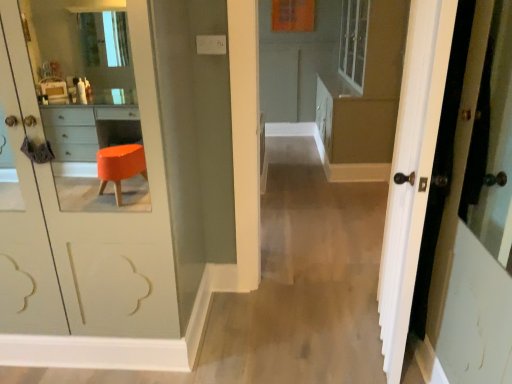
Image resolution: width=512 pixels, height=384 pixels. What are the coordinates of `white wood door at right` in the screenshot? It's located at (462, 201).

What do you see at coordinates (462, 201) in the screenshot? I see `white wood door at right` at bounding box center [462, 201].

Measure the distance between point (398, 222) and camera.

Point (398, 222) is 5.68 feet from camera.

Find the location of a particular element. The width and height of the screenshot is (512, 384). matte brown dresser at center is located at coordinates (353, 131).

Measure the distance between point (376, 173) and camera.

Point (376, 173) and camera are 4.23 meters apart.

The width and height of the screenshot is (512, 384). Describe the element at coordinates (353, 131) in the screenshot. I see `matte brown dresser at center` at that location.

Image resolution: width=512 pixels, height=384 pixels. I want to click on white wood door at right, so click(462, 201).

Is matte brown dresser at center to the right of white wood door at right from the viewer's perspective?

Yes.

Is the position of matte brown dresser at center more distant than that of white wood door at right?

Yes, matte brown dresser at center is behind white wood door at right.

Is point (372, 107) less distant than point (500, 210)?

No.

From the image's perspective, is matte brown dresser at center beneath white wood door at right?

No.

From a real-world perspective, which object stands above the other?

In real-world perspective, matte brown dresser at center is above.

Which object is wider, matte brown dresser at center or white wood door at right?

matte brown dresser at center is wider.

Between matte brown dresser at center and white wood door at right, which one has more height?

Standing taller between the two is matte brown dresser at center.

Based on their sizes in the image, would you say matte brown dresser at center is bigger or smaller than white wood door at right?

Considering their sizes, matte brown dresser at center takes up more space than white wood door at right.

Is matte brown dresser at center located outside white wood door at right?

Yes, matte brown dresser at center is located beyond the bounds of white wood door at right.

Would you consider matte brown dresser at center to be distant from white wood door at right?

Yes, matte brown dresser at center and white wood door at right are located far from each other.

Could you tell me if matte brown dresser at center is turned towards white wood door at right?

No, matte brown dresser at center is not turned towards white wood door at right.

How many degrees apart are the facing directions of matte brown dresser at center and white wood door at right?

The facing directions of matte brown dresser at center and white wood door at right are 9.44 degrees apart.

Identify the location of door directly beneath the matte brown dresser at center (from a real-world perspective). (462, 201).

Which is more to the right, white wood door at right or matte brown dresser at center?

matte brown dresser at center is more to the right.

Is white wood door at right positioned in front of matte brown dresser at center?

Yes, white wood door at right is in front of matte brown dresser at center.

Which point is more distant from viewer, (471, 83) or (328, 85)?

The point (328, 85) is more distant.

From the image's perspective, is white wood door at right located above matte brown dresser at center?

Actually, white wood door at right appears below matte brown dresser at center in the image.

From a real-world perspective, which object rests below the other?

From a 3D spatial view, white wood door at right is below.

Can you confirm if white wood door at right is thinner than matte brown dresser at center?

Correct, the width of white wood door at right is less than that of matte brown dresser at center.

Considering the relative sizes of white wood door at right and matte brown dresser at center in the image provided, is white wood door at right shorter than matte brown dresser at center?

Yes.

Considering the relative sizes of white wood door at right and matte brown dresser at center in the image provided, is white wood door at right bigger than matte brown dresser at center?

Incorrect, white wood door at right is not larger than matte brown dresser at center.

Is white wood door at right spatially inside matte brown dresser at center, or outside of it?

white wood door at right is not enclosed by matte brown dresser at center.

Based on the photo, is white wood door at right far from matte brown dresser at center?

That's right, there is a large distance between white wood door at right and matte brown dresser at center.

Is white wood door at right aimed at matte brown dresser at center?

No, white wood door at right is not aimed at matte brown dresser at center.

How many degrees apart are the facing directions of white wood door at right and matte brown dresser at center?

The angular difference between white wood door at right and matte brown dresser at center is 9.44 degrees.

Measure the distance between white wood door at right and matte brown dresser at center.

white wood door at right is 2.57 meters from matte brown dresser at center.

You are a GUI agent. You are given a task and a screenshot of the screen. Output one action in this format:
    pyautogui.click(x=<x>, y=<y>)
    Task: Click on the door lying in front of the matte brown dresser at center
    This screenshot has width=512, height=384.
    Given the screenshot: What is the action you would take?
    pyautogui.click(x=462, y=201)

Where is `door below the matte brown dresser at center (from the image's perspective)`? This screenshot has width=512, height=384. door below the matte brown dresser at center (from the image's perspective) is located at coordinates (462, 201).

Find the location of `door located in front of the matte brown dresser at center`. door located in front of the matte brown dresser at center is located at coordinates (462, 201).